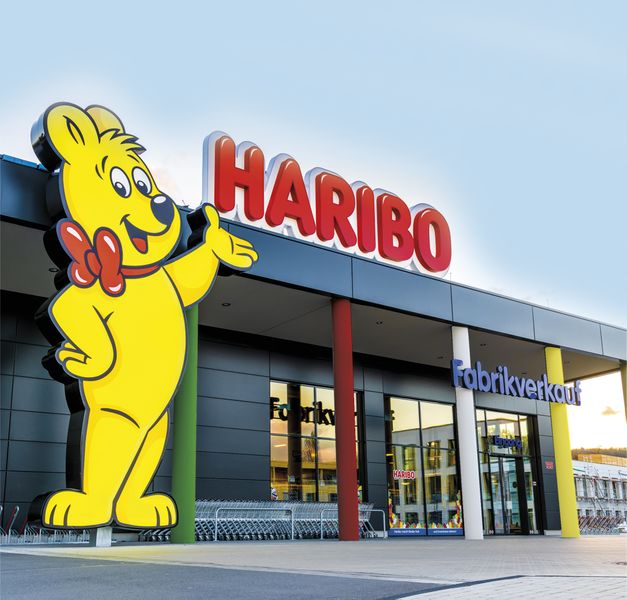
Locate an element on the screen. The image size is (627, 600). white pillar is located at coordinates (470, 472).